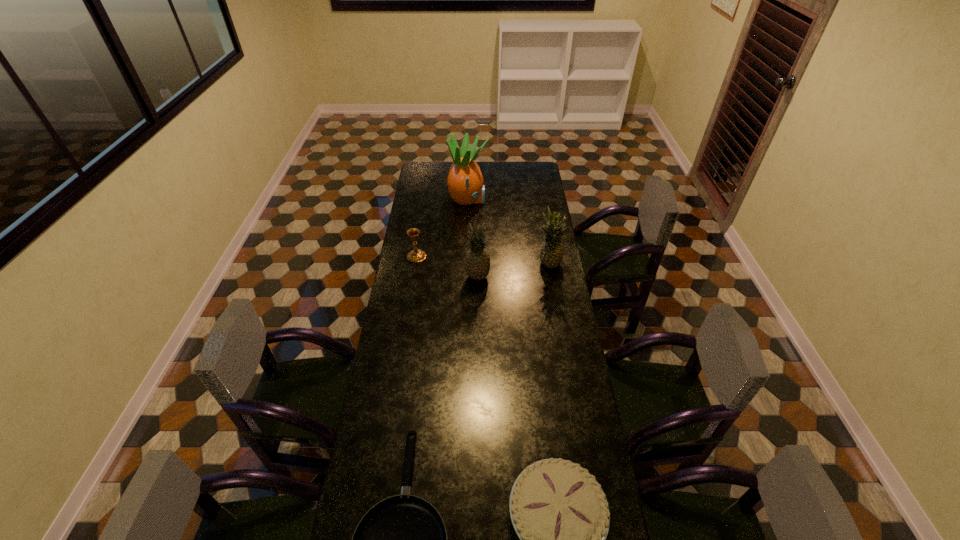
In the image, there is a desktop. Find the location of `vacant space at the left edge`. vacant space at the left edge is located at coordinates (418, 377).

Locate an element on the screen. free space at the right edge is located at coordinates (549, 201).

Identify the location of vacant area that lies between the rightmost pineapple and the farthest object. (509, 232).

Locate which object ranks fourth in proximity to the tallest object. Please provide its 2D coordinates. Your answer should be formatted as a tuple, i.e. [(x, y)], where the tuple contains the x and y coordinates of a point satisfying the conditions above.

[(402, 539)]

This screenshot has width=960, height=540. In order to click on object that ranks as the fourth closest to the fourth tallest object in this screenshot , I will do `click(402, 539)`.

Identify the location of pineapple object that ranks as the second closest to the farthest object. The image size is (960, 540). (477, 265).

Locate an element on the screen. pineapple that stands as the closest to the frying pan is located at coordinates (477, 265).

Find the location of a particular element. vacant area that satisfies the following two spatial constraints: 1. at the entrance of the tallest object; 2. on the front side of the fourth tallest object is located at coordinates (466, 256).